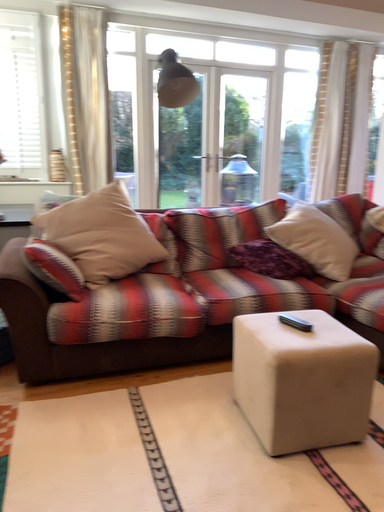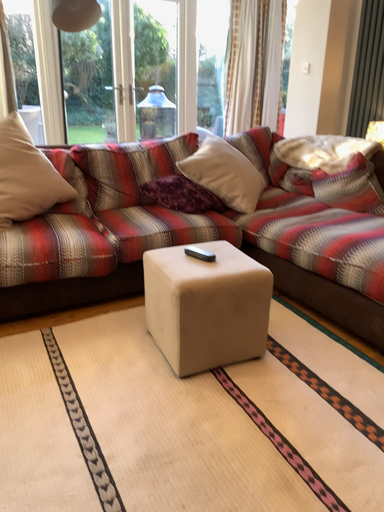
Question: How did the camera likely rotate when shooting the video?

Choices:
 (A) rotated left
 (B) rotated right

Answer: (B)